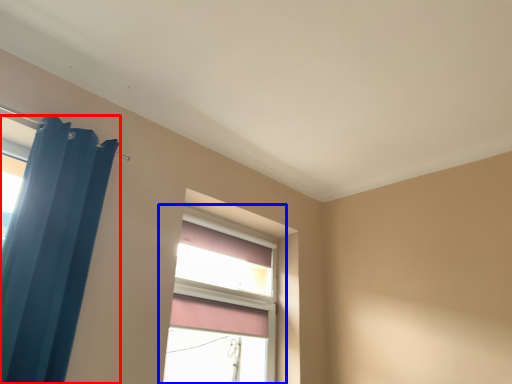
Question: Among these objects, which one is farthest to the camera, curtain (highlighted by a red box) or window (highlighted by a blue box)?

Choices:
 (A) curtain
 (B) window

Answer: (B)